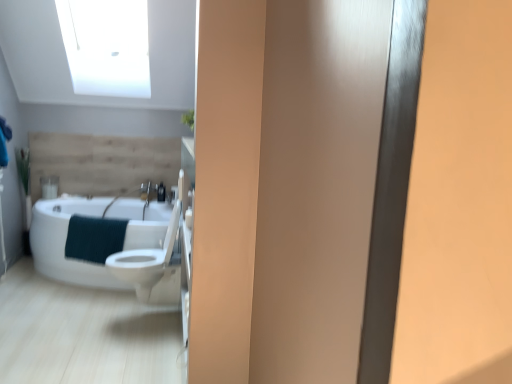
Question: Would you say white glossy sink at center is inside or outside teal textured towel at lower left?

Choices:
 (A) outside
 (B) inside

Answer: (A)

Question: Is point (142, 213) positioned closer to the camera than point (119, 233)?

Choices:
 (A) closer
 (B) farther

Answer: (B)

Question: Considering the real-world distances, which object is closest to the white glossy sink at center?

Choices:
 (A) white glossy toilet at center
 (B) white glossy bathtub at left
 (C) teal textured towel at lower left
 (D) matte black soap dispenser at center

Answer: (D)

Question: Estimate the real-world distances between objects in this image. Which object is farther from the white glossy toilet at center?

Choices:
 (A) teal textured towel at lower left
 (B) matte black soap dispenser at center
 (C) white glossy sink at center
 (D) white glossy bathtub at left

Answer: (B)